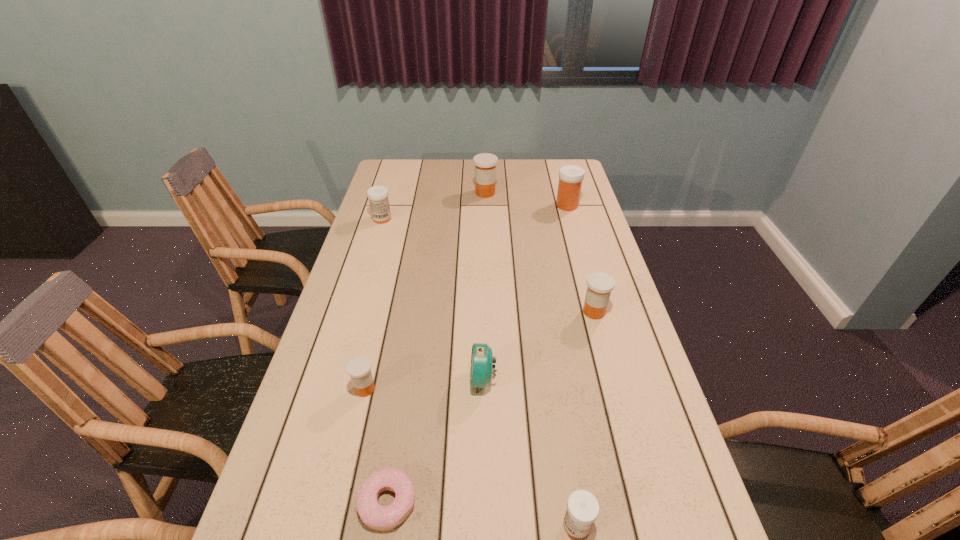
Locate an element on the screen. The height and width of the screenshot is (540, 960). the nearest orange medicine is located at coordinates (359, 368).

Locate an element on the screen. The width and height of the screenshot is (960, 540). the third object from left to right is located at coordinates (375, 516).

At what (x,y) coordinates should I click in order to perform the action: click on doughnut. Please return your answer as a coordinate pair (x, y). Image resolution: width=960 pixels, height=540 pixels. Looking at the image, I should click on (375, 516).

The width and height of the screenshot is (960, 540). Identify the location of free point located on the label of the farthest object. coord(487,256).

Where is `vacant space located 0.250m on the back of the biggest white medicine`? vacant space located 0.250m on the back of the biggest white medicine is located at coordinates click(557, 170).

At what (x,y) coordinates should I click in order to perform the action: click on vacant space located 0.190m on the label of the second smallest orange medicine. Please return your answer as a coordinate pair (x, y). Looking at the image, I should click on (516, 312).

Locate an element on the screen. This screenshot has width=960, height=540. vacant area situated on the label of the second smallest orange medicine is located at coordinates (553, 312).

Where is `vacant area situated on the label of the second smallest orange medicine`? The image size is (960, 540). vacant area situated on the label of the second smallest orange medicine is located at coordinates (512, 312).

This screenshot has width=960, height=540. In order to click on vacant area located on the front of the leftmost object in this screenshot , I will do `click(364, 278)`.

The height and width of the screenshot is (540, 960). Find the location of `vacant space located 0.220m on the front-facing side of the blue alarm clock`. vacant space located 0.220m on the front-facing side of the blue alarm clock is located at coordinates (382, 380).